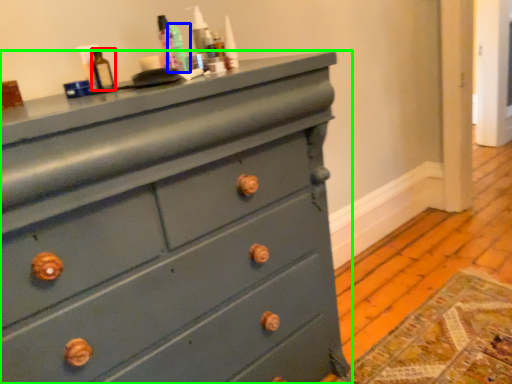
Question: Which object is the farthest from bottle (highlighted by a red box)? Choose among these: teal (highlighted by a blue box) or chest of drawers (highlighted by a green box).

Choices:
 (A) teal
 (B) chest of drawers

Answer: (B)